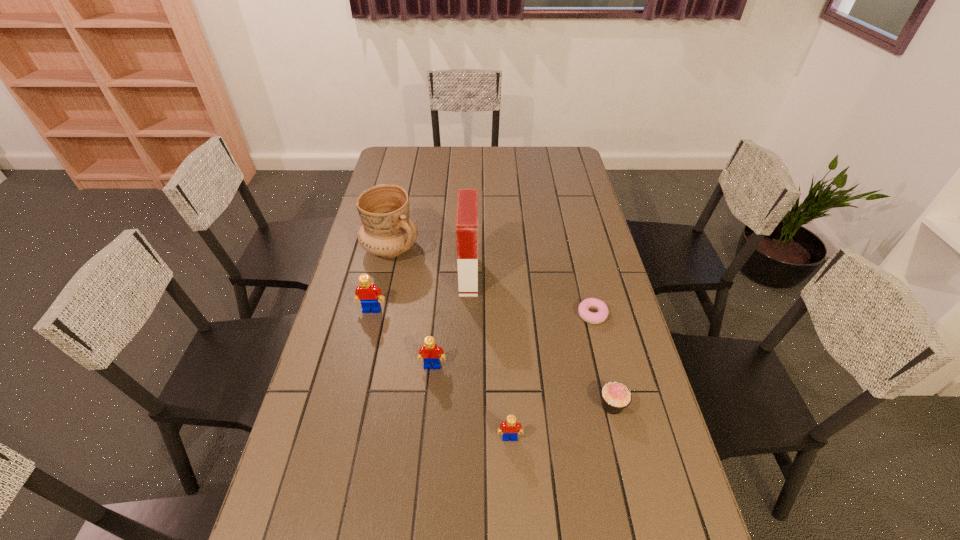
Where is `free point that keeps the Legos evenly spaced on the right`? free point that keeps the Legos evenly spaced on the right is located at coordinates (612, 533).